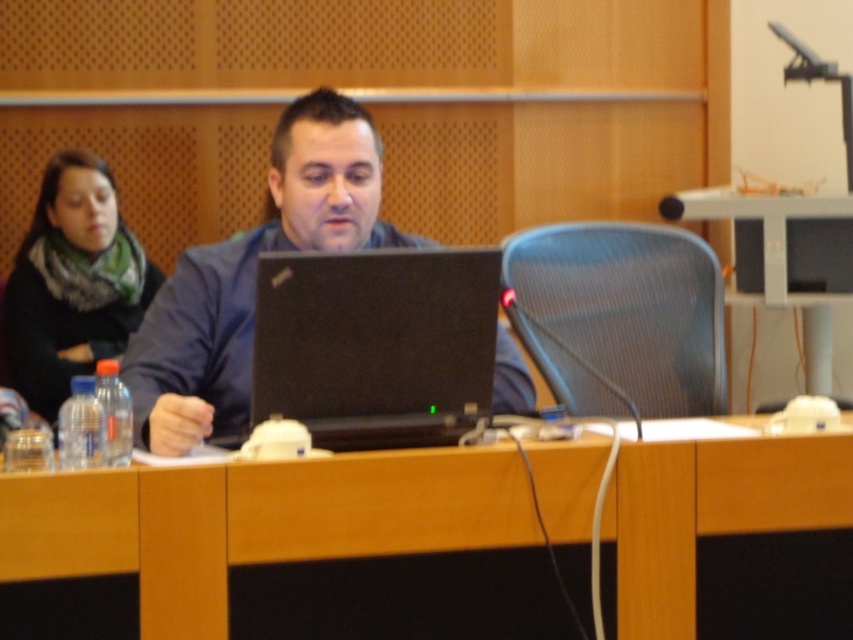
You are standing at the entrance of the conference room and see two points marked on the floor. The first point is at coordinate point (231,340) and the second point is at coordinate point (48,308). Which point is closer to the man sitting at the wooden desk?

Point (231,340) is in front of point (48,308), so it is closer to the man sitting at the wooden desk.

You are organizing a meeting in the room described. You need to place a large document on the table that is higher up. Which table should you choose between the wooden table at center and the metallic silver table at center?

The metallic silver table at center is higher up, so you should place the large document on the metallic silver table at center.

You are standing in the conference room and want to place a 1.5 meter long banner on the wooden table at center. Will the banner fit on the table?

The wooden table at center is 1.62 meters from the camera, but this measurement refers to its distance, not its length. The banner length cannot be determined based on the given information.